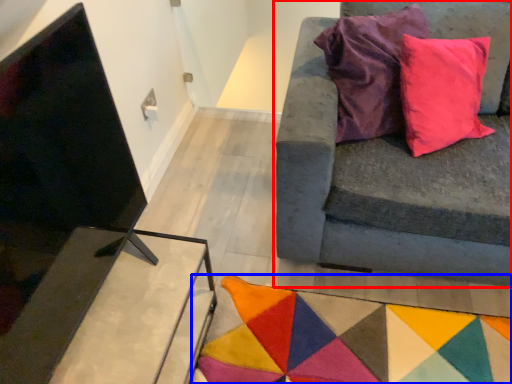
Question: Among these objects, which one is farthest to the camera, studio couch (highlighted by a red box) or mat (highlighted by a blue box)?

Choices:
 (A) studio couch
 (B) mat

Answer: (B)